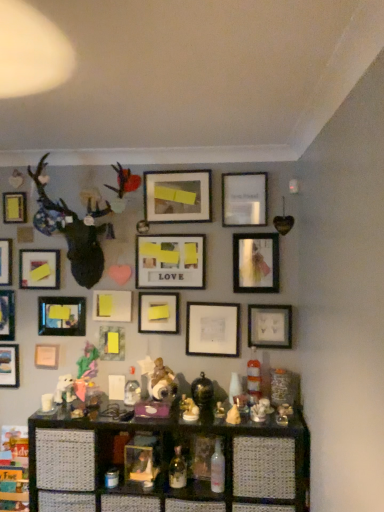
Locate an element on the screen. Image resolution: width=384 pixels, height=512 pixels. yellow matte picture frame at center, placed as the ninth picture frame when sorted from left to right is located at coordinates (112, 306).

How much space does yellow matte picture frame at center, placed as the ninth picture frame when sorted from left to right, occupy horizontally?

2.65 inches.

The image size is (384, 512). Describe the element at coordinates (244, 199) in the screenshot. I see `matte black picture frame at upper center, the third picture frame positioned from the right` at that location.

Describe the element at coordinates (261, 410) in the screenshot. The height and width of the screenshot is (512, 384). I see `white porcelain figurine at center, marked as the 3th toy in a left-to-right arrangement` at that location.

Locate an element on the screen. The image size is (384, 512). matte yellow picture frame at upper left, the 12th picture frame from the right is located at coordinates (14, 207).

The image size is (384, 512). What do you see at coordinates (170, 261) in the screenshot?
I see `matte wooden picture frame at center, arranged as the 5th picture frame when viewed from the right` at bounding box center [170, 261].

What do you see at coordinates (9, 366) in the screenshot?
I see `matte black picture frame at lower left, the thirteenth picture frame from the right` at bounding box center [9, 366].

Where is `matte black picture frame at lower left, the thirteenth picture frame from the right`? This screenshot has height=512, width=384. matte black picture frame at lower left, the thirteenth picture frame from the right is located at coordinates (9, 366).

The image size is (384, 512). Find the location of `matte black picture frame at left, which appears as the 2th picture frame when viewed from the left`. matte black picture frame at left, which appears as the 2th picture frame when viewed from the left is located at coordinates (7, 315).

Which of these two, matte wooden picture frame at center, the eleventh picture frame from the left, or yellow matte picture frame at upper left, arranged as the eleventh picture frame when viewed from the right, is bigger?

matte wooden picture frame at center, the eleventh picture frame from the left.

From the image's perspective, which object appears higher, matte wooden picture frame at center, the eleventh picture frame from the left, or yellow matte picture frame at upper left, which ranks as the 5th picture frame in left-to-right order?

matte wooden picture frame at center, the eleventh picture frame from the left, appears higher in the image.

Can you confirm if matte wooden picture frame at center, arranged as the 5th picture frame when viewed from the right, is positioned to the left of yellow matte picture frame at upper left, which ranks as the 5th picture frame in left-to-right order?

In fact, matte wooden picture frame at center, arranged as the 5th picture frame when viewed from the right, is to the right of yellow matte picture frame at upper left, which ranks as the 5th picture frame in left-to-right order.

Can you confirm if wooden shelf at lower center is positioned to the right of white porcelain figurine at center, marked as the 3th toy in a left-to-right arrangement?

Incorrect, wooden shelf at lower center is not on the right side of white porcelain figurine at center, marked as the 3th toy in a left-to-right arrangement.

Considering the sizes of wooden shelf at lower center and white porcelain figurine at center, marked as the second toy in a right-to-left arrangement, in the image, is wooden shelf at lower center wider or thinner than white porcelain figurine at center, marked as the second toy in a right-to-left arrangement,?

Considering their sizes, wooden shelf at lower center looks broader than white porcelain figurine at center, marked as the second toy in a right-to-left arrangement.

Does wooden shelf at lower center touch white porcelain figurine at center, marked as the second toy in a right-to-left arrangement?

wooden shelf at lower center and white porcelain figurine at center, marked as the second toy in a right-to-left arrangement, are clearly separated.

From a real-world perspective, between wooden shelf at lower center and white porcelain figurine at center, marked as the 3th toy in a left-to-right arrangement, who is vertically higher?

white porcelain figurine at center, marked as the 3th toy in a left-to-right arrangement.

Measure the distance from matte black picture frame at left, positioned as the fourteenth picture frame in right-to-left order, to wooden shelf at lower center.

A distance of 1.20 meters exists between matte black picture frame at left, positioned as the fourteenth picture frame in right-to-left order, and wooden shelf at lower center.

Could you tell me if matte black picture frame at left, positioned as the fourteenth picture frame in right-to-left order, is turned towards wooden shelf at lower center?

No, matte black picture frame at left, positioned as the fourteenth picture frame in right-to-left order, does not turn towards wooden shelf at lower center.

Can you confirm if matte black picture frame at left, which appears as the 2th picture frame when viewed from the left, is shorter than wooden shelf at lower center?

Indeed, matte black picture frame at left, which appears as the 2th picture frame when viewed from the left, has a lesser height compared to wooden shelf at lower center.

Is matte black picture frame at left, which appears as the 2th picture frame when viewed from the left, bigger or smaller than wooden shelf at lower center?

Result: In the image, matte black picture frame at left, which appears as the 2th picture frame when viewed from the left, appears to be smaller than wooden shelf at lower center.

Can you confirm if metallic gold figurine at lower right, positioned as the 1th toy in right-to-left order, is positioned to the left of yellow matte picture frame at center, positioned as the eighth picture frame in right-to-left order?

No.

From a real-world perspective, who is located higher, metallic gold figurine at lower right, positioned as the 1th toy in right-to-left order, or yellow matte picture frame at center, the 8th picture frame positioned from the left?

yellow matte picture frame at center, the 8th picture frame positioned from the left, is physically above.

Which object is further away from the camera taking this photo, metallic gold figurine at lower right, marked as the fourth toy in a left-to-right arrangement, or yellow matte picture frame at center, positioned as the eighth picture frame in right-to-left order?

yellow matte picture frame at center, positioned as the eighth picture frame in right-to-left order, is behind.

Who is shorter, translucent glass bottle at center or matte black picture frame at lower left, the ninth picture frame from the right?

Standing shorter between the two is translucent glass bottle at center.

I want to click on picture frame that is the 5th one when counting leftward from the translucent glass bottle at center, so click(x=62, y=316).

Considering the points (183, 471) and (51, 306), which point is behind, point (183, 471) or point (51, 306)?

The point (51, 306) is farther.

Is translucent glass bottle at center next to matte black picture frame at lower left, the ninth picture frame from the right?

No.

Considering the positions of objects matte black picture frame at lower left, the ninth picture frame from the right, and shiny gold figurine at center, positioned as the 3th toy in right-to-left order, in the image provided, who is more to the left, matte black picture frame at lower left, the ninth picture frame from the right, or shiny gold figurine at center, positioned as the 3th toy in right-to-left order,?

From the viewer's perspective, matte black picture frame at lower left, the ninth picture frame from the right, appears more on the left side.

Looking at this image, considering the relative sizes of matte black picture frame at lower left, placed as the 7th picture frame when sorted from left to right, and shiny gold figurine at center, marked as the second toy in a left-to-right arrangement, in the image provided, is matte black picture frame at lower left, placed as the 7th picture frame when sorted from left to right, smaller than shiny gold figurine at center, marked as the second toy in a left-to-right arrangement,?

Actually, matte black picture frame at lower left, placed as the 7th picture frame when sorted from left to right, might be larger than shiny gold figurine at center, marked as the second toy in a left-to-right arrangement.

Does matte black picture frame at lower left, placed as the 7th picture frame when sorted from left to right, have a greater width compared to shiny gold figurine at center, positioned as the 3th toy in right-to-left order?

Incorrect, the width of matte black picture frame at lower left, placed as the 7th picture frame when sorted from left to right, does not surpass that of shiny gold figurine at center, positioned as the 3th toy in right-to-left order.

Which object is further away from the camera, matte white picture frame at lower left, the tenth picture frame from the right, or matte black picture frame at upper center, the third picture frame positioned from the right?

matte white picture frame at lower left, the tenth picture frame from the right, is further away from the camera.

Considering the sizes of matte white picture frame at lower left, positioned as the 6th picture frame in left-to-right order, and matte black picture frame at upper center, placed as the thirteenth picture frame when sorted from left to right, in the image, is matte white picture frame at lower left, positioned as the 6th picture frame in left-to-right order, taller or shorter than matte black picture frame at upper center, placed as the thirteenth picture frame when sorted from left to right,?

matte white picture frame at lower left, positioned as the 6th picture frame in left-to-right order, is shorter than matte black picture frame at upper center, placed as the thirteenth picture frame when sorted from left to right.

The height and width of the screenshot is (512, 384). I want to click on the 2nd picture frame positioned below the matte wooden picture frame at center, arranged as the 5th picture frame when viewed from the right (from a real-world perspective), so click(39, 269).

From the wooden shelf at lower center, count 2nd toys backward and point to it. Please provide its 2D coordinates.

[(261, 410)]

Based on their spatial positions, is matte white picture frame at lower left, positioned as the 6th picture frame in left-to-right order, or shiny gold figurine at center, which is the 4th toy from right to left, further from matte black picture frame at left, which appears as the 2th picture frame when viewed from the left?

Among the two, shiny gold figurine at center, which is the 4th toy from right to left, is located further to matte black picture frame at left, which appears as the 2th picture frame when viewed from the left.

When comparing their distances from shiny gold figurine at center, positioned as the first toy in left-to-right order, does matte white picture frame at lower left, the tenth picture frame from the right, or matte white frame at center, the twelfth picture frame viewed from the left, seem further?

matte white picture frame at lower left, the tenth picture frame from the right, is further to shiny gold figurine at center, positioned as the first toy in left-to-right order.

Which object lies further to the anchor point matte white picture frame at center, which is the 10th picture frame in left-to-right order, matte wooden picture frame at center, the eleventh picture frame from the left, or matte white picture frame at lower left, the tenth picture frame from the right?

matte white picture frame at lower left, the tenth picture frame from the right, is positioned further to the anchor matte white picture frame at center, which is the 10th picture frame in left-to-right order.

Estimate the real-world distances between objects in this image. Which object is further from wooden shelf at lower center, yellow matte picture frame at center, the 8th picture frame positioned from the left, or matte yellow picture frame at upper left, the 12th picture frame from the right?

matte yellow picture frame at upper left, the 12th picture frame from the right, lies further to wooden shelf at lower center than the other object.

Looking at this image, from the image, which object appears to be farther from matte black picture frame at upper center, the third picture frame positioned from the right, yellow matte picture frame at center, which is counted as the seventh picture frame, starting from the right, or matte yellow picture frame at upper left, acting as the fourth picture frame starting from the left?

The object further to matte black picture frame at upper center, the third picture frame positioned from the right, is matte yellow picture frame at upper left, acting as the fourth picture frame starting from the left.

When comparing their distances from metallic gold figurine at lower right, marked as the fourth toy in a left-to-right arrangement, does yellow matte picture frame at upper left, which ranks as the 5th picture frame in left-to-right order, or matte black picture frame at upper center, placed as the thirteenth picture frame when sorted from left to right, seem closer?

Based on the image, matte black picture frame at upper center, placed as the thirteenth picture frame when sorted from left to right, appears to be nearer to metallic gold figurine at lower right, marked as the fourth toy in a left-to-right arrangement.

Which object lies nearer to the anchor point yellow matte picture frame at upper left, which ranks as the 5th picture frame in left-to-right order, matte black picture frame at left, which appears as the 2th picture frame when viewed from the left, or white porcelain figurine at center, marked as the 3th toy in a left-to-right arrangement?

The object closer to yellow matte picture frame at upper left, which ranks as the 5th picture frame in left-to-right order, is matte black picture frame at left, which appears as the 2th picture frame when viewed from the left.

When comparing their distances from matte black picture frame at upper right, the fourteenth picture frame positioned from the left, does yellow matte picture frame at upper left, which ranks as the 5th picture frame in left-to-right order, or wooden shelf at lower center seem closer?

wooden shelf at lower center is closer to matte black picture frame at upper right, the fourteenth picture frame positioned from the left.

Identify the location of bottle between yellow matte picture frame at upper left, which ranks as the 5th picture frame in left-to-right order, and matte white frame at center, the twelfth picture frame viewed from the left, from left to right. (177, 470).

This screenshot has height=512, width=384. I want to click on shelf situated between matte black picture frame at left, which appears as the 2th picture frame when viewed from the left, and matte black picture frame at upper right, the second picture frame in the right-to-left sequence, from left to right, so click(x=167, y=462).

Find the location of a particular element. shelf located between matte black picture frame at left, positioned as the fourteenth picture frame in right-to-left order, and metallic gold figurine at lower right, positioned as the 1th toy in right-to-left order, in the left-right direction is located at coordinates (167, 462).

Find the location of `shelf located between matte black picture frame at lower left, the thirteenth picture frame from the right, and translucent glass bottle at center in the left-right direction`. shelf located between matte black picture frame at lower left, the thirteenth picture frame from the right, and translucent glass bottle at center in the left-right direction is located at coordinates (167, 462).